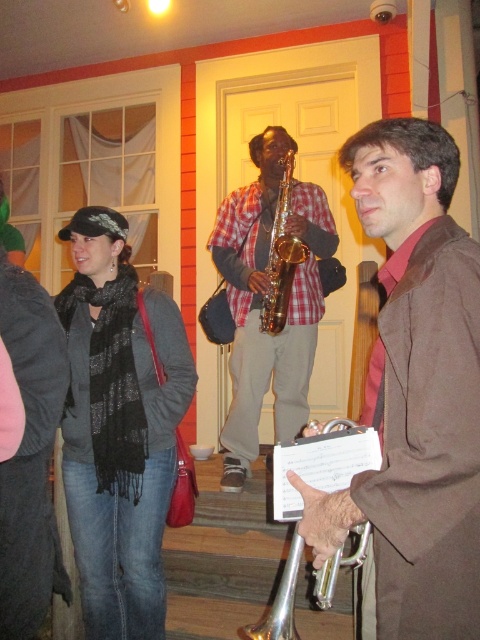
You are standing in the room and want to locate the black scarf at left. According to the scene description, where would you find it?

The black scarf at left is located at the 2D coordinates of point (119, 428) in the scene.

Based on the photo, where is the checkered fabric shirt at center located in the image?

The checkered fabric shirt at center is located at point (262, 298).